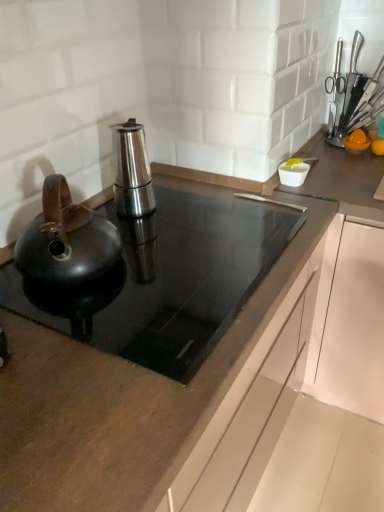
The height and width of the screenshot is (512, 384). Identify the location of vacant area located to the right-hand side of shiny black kettle at left, positioned as the second kitchen appliance in back-to-front order. (170, 264).